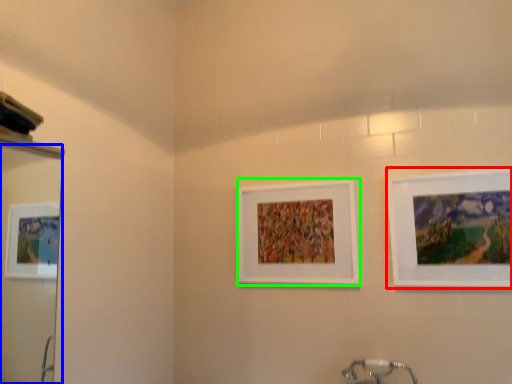
Question: Estimate the real-world distances between objects in this image. Which object is farther from picture frame (highlighted by a red box), mirror (highlighted by a blue box) or picture frame (highlighted by a green box)?

Choices:
 (A) mirror
 (B) picture frame

Answer: (A)